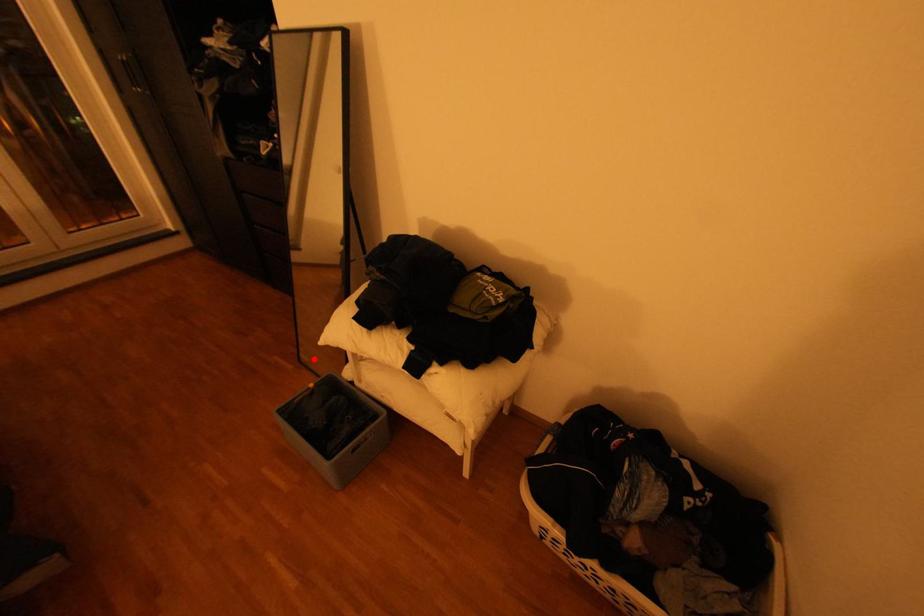
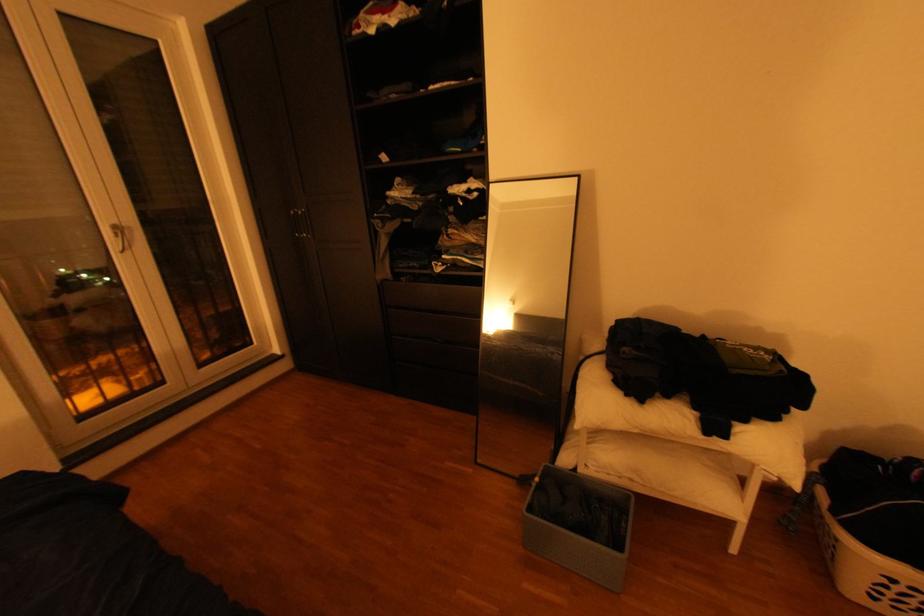
Question: I am providing you with two images of the same scene from different viewpoints. A red point is shown in image1. For the corresponding object point in image2, is it positioned nearer or farther from the camera?

Choices:
 (A) Nearer
 (B) Farther

Answer: (A)